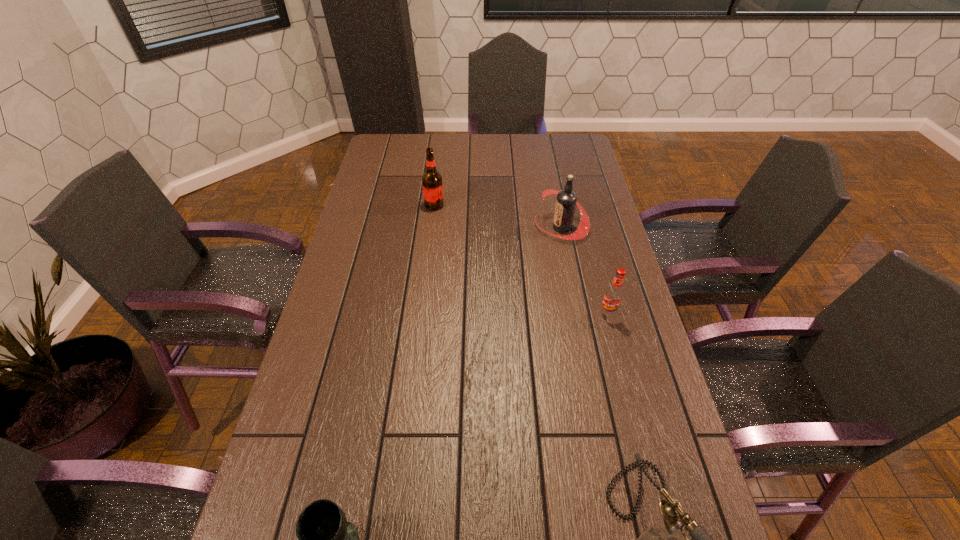
Find the location of `vacant space that satisfies the following two spatial constraints: 1. on the label of the second farthest object; 2. on the right side of the nearest root beer`. vacant space that satisfies the following two spatial constraints: 1. on the label of the second farthest object; 2. on the right side of the nearest root beer is located at coordinates (579, 314).

Where is `vacant region that satisfies the following two spatial constraints: 1. on the back side of the shortest root beer; 2. on the label of the second nearest root beer`? Image resolution: width=960 pixels, height=540 pixels. vacant region that satisfies the following two spatial constraints: 1. on the back side of the shortest root beer; 2. on the label of the second nearest root beer is located at coordinates (586, 227).

This screenshot has height=540, width=960. Find the location of `free spot that satisfies the following two spatial constraints: 1. on the front side of the nearest root beer; 2. on the left side of the farthest root beer`. free spot that satisfies the following two spatial constraints: 1. on the front side of the nearest root beer; 2. on the left side of the farthest root beer is located at coordinates (421, 314).